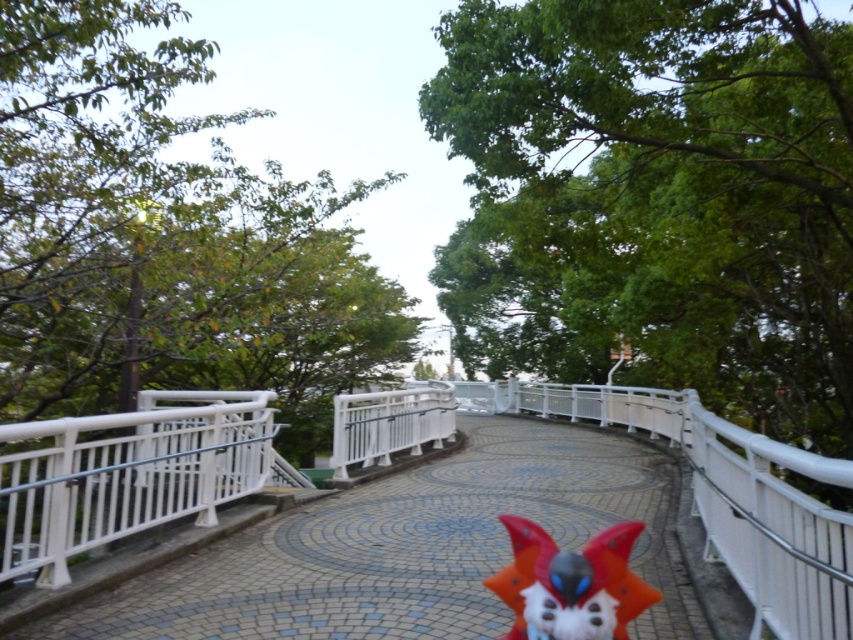
Locate an element on the screen. white glossy bridge at center is located at coordinates (412, 548).

Image resolution: width=853 pixels, height=640 pixels. Describe the element at coordinates (412, 548) in the screenshot. I see `white glossy bridge at center` at that location.

Locate an element on the screen. This screenshot has width=853, height=640. white glossy bridge at center is located at coordinates (412, 548).